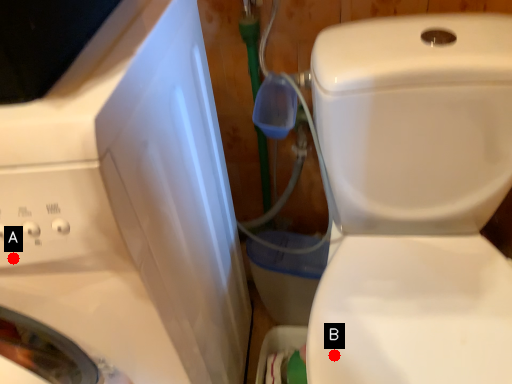
Question: Two points are circled on the image, labeled by A and B beside each circle. Which of the following is the closest to the observer?

Choices:
 (A) A is closer
 (B) B is closer

Answer: (A)